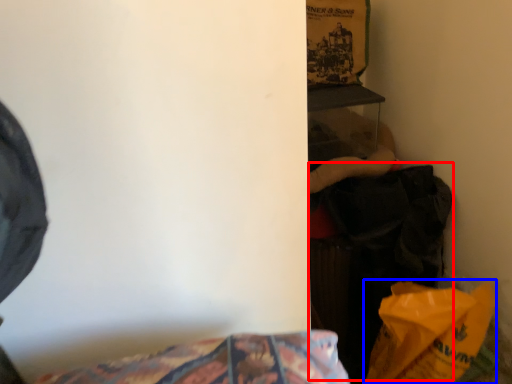
Question: Which object is further to the camera taking this photo, clothing (highlighted by a red box) or paper bag (highlighted by a blue box)?

Choices:
 (A) clothing
 (B) paper bag

Answer: (A)